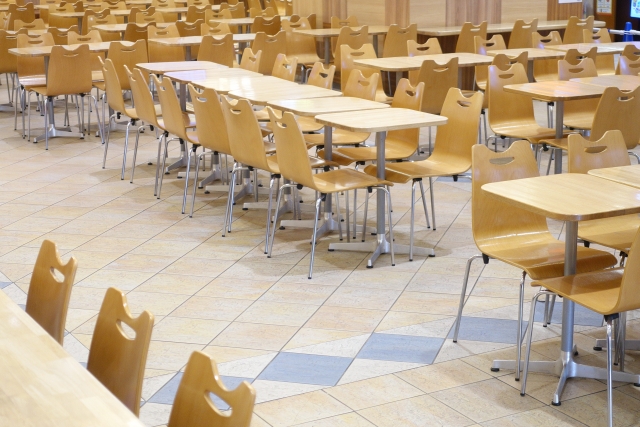
The width and height of the screenshot is (640, 427). I want to click on pale blue floor tiles, so click(143, 403), click(84, 363), click(65, 332), click(19, 302), click(4, 284), click(177, 388), click(316, 373), click(395, 349), click(489, 325), click(587, 314).